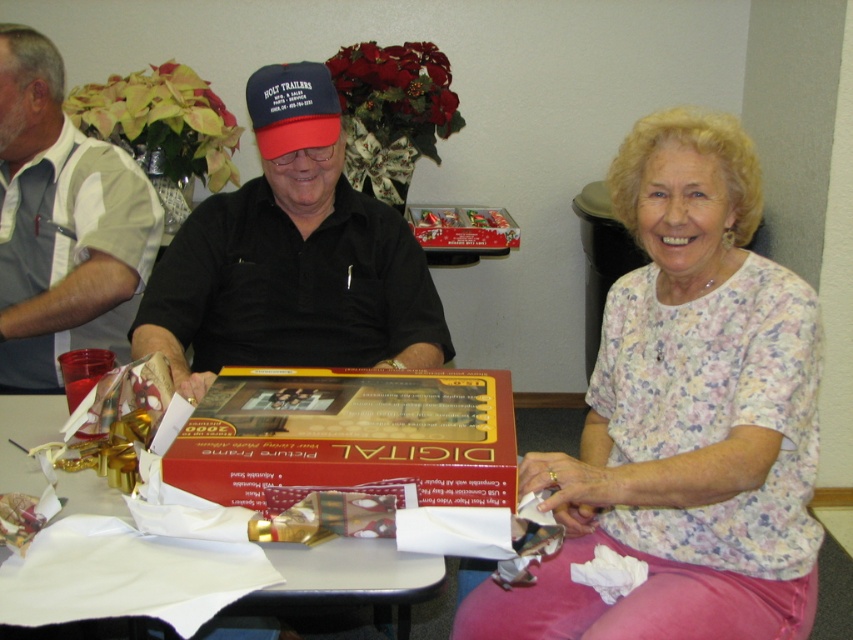
Looking at the two people at the table, which one is wearing the floral fabric blouse at center and is positioned to the right of the gray fabric shirt at left?

The floral fabric blouse at center is worn by the person positioned to the right of the gray fabric shirt at left.

You are at a holiday gathering and see the gray fabric shirt at left and the white paper at center. Which object is closer to the left side of the table?

The gray fabric shirt at left is closer to the left side of the table because it is positioned to the left of the white paper at center.